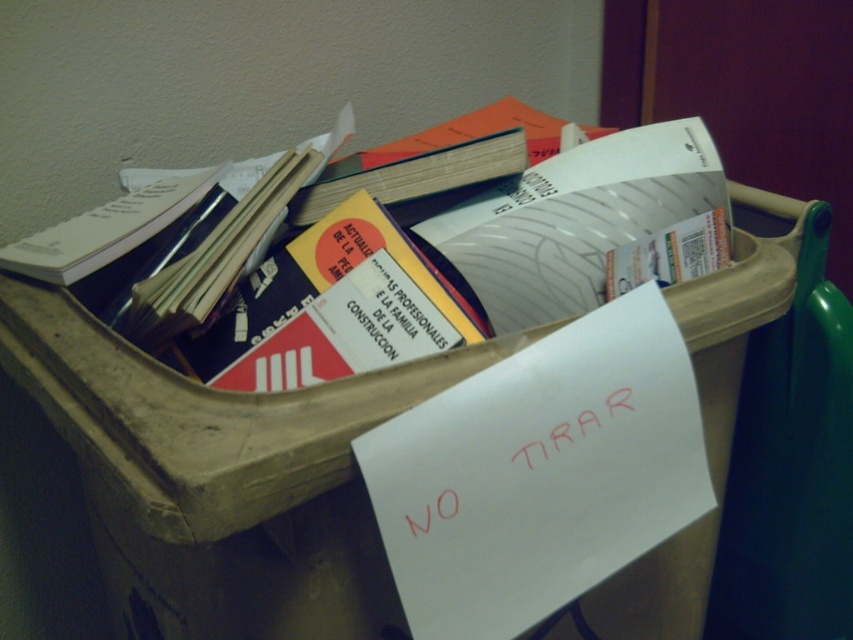
Question: Estimate the real-world distances between objects in this image. Which object is farther from the hardcover book at center?

Choices:
 (A) white paper book at upper left
 (B) white glossy paper at center

Answer: (A)

Question: Is white glossy paper at center to the right of white paper book at upper left from the viewer's perspective?

Choices:
 (A) yes
 (B) no

Answer: (A)

Question: Is white glossy paper at center closer to the viewer compared to white paper book at upper left?

Choices:
 (A) no
 (B) yes

Answer: (A)

Question: Which object appears closest to the camera in this image?

Choices:
 (A) white glossy paper at center
 (B) hardcover book at center

Answer: (A)

Question: Is white glossy paper at center to the left of hardcover book at center from the viewer's perspective?

Choices:
 (A) yes
 (B) no

Answer: (B)

Question: Which point appears closest to the camera in this image?

Choices:
 (A) (605, 292)
 (B) (114, 244)
 (C) (309, 221)

Answer: (B)